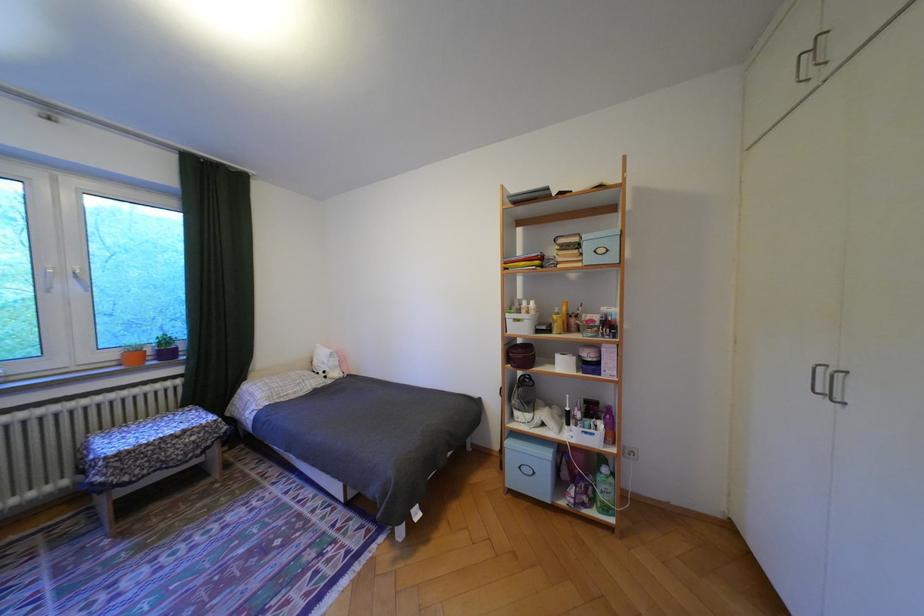
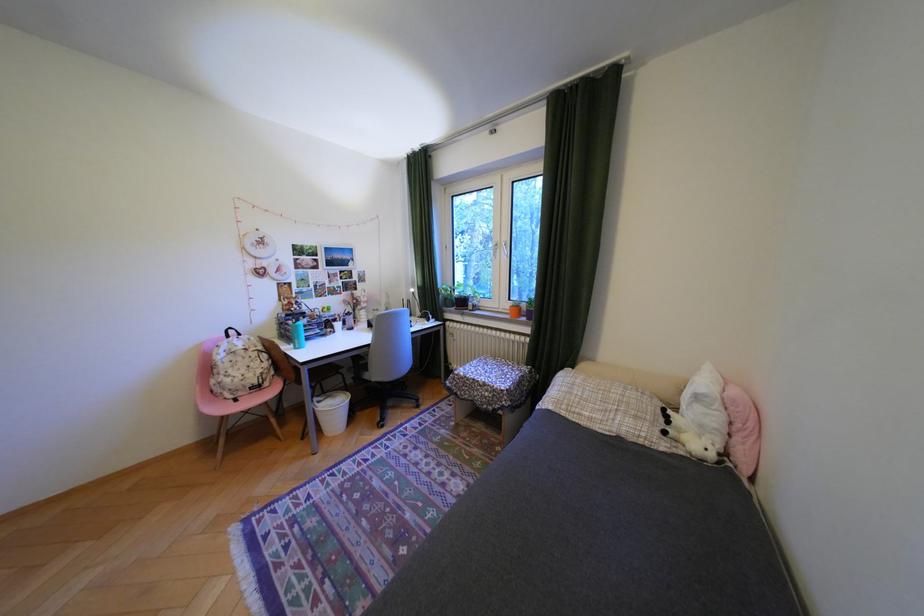
The point at (337, 377) is marked in the first image. Where is the corresponding point in the second image?

(676, 432)